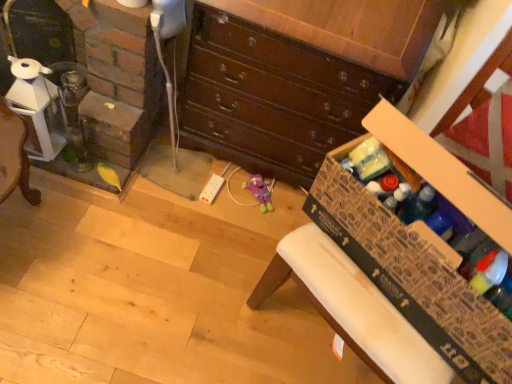
Question: Is cardboard box at lower right situated inside wooden chest of drawers at center or outside?

Choices:
 (A) inside
 (B) outside

Answer: (B)

Question: Does point (330, 172) appear closer or farther from the camera than point (375, 79)?

Choices:
 (A) farther
 (B) closer

Answer: (B)

Question: Considering the real-world distances, which object is farthest from the clear glass fireplace at left?

Choices:
 (A) wooden chest of drawers at center
 (B) cardboard box at lower right

Answer: (B)

Question: Which object is positioned farthest from the clear glass fireplace at left?

Choices:
 (A) wooden chest of drawers at center
 (B) cardboard box at lower right

Answer: (B)